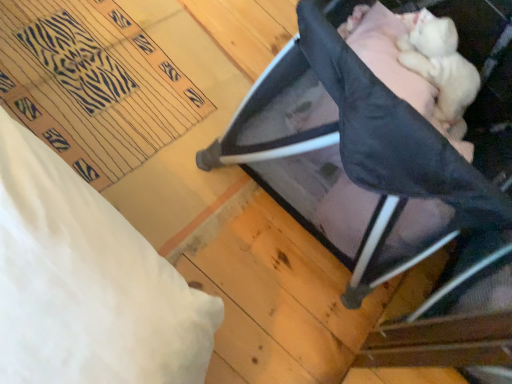
Question: Is black mesh playpen at upper right beside white fluffy newborn at upper right?

Choices:
 (A) no
 (B) yes

Answer: (A)

Question: Is black mesh playpen at upper right to the right of white fluffy newborn at upper right from the viewer's perspective?

Choices:
 (A) no
 (B) yes

Answer: (A)

Question: From the image's perspective, is black mesh playpen at upper right over white fluffy newborn at upper right?

Choices:
 (A) yes
 (B) no

Answer: (B)

Question: Could you tell me if black mesh playpen at upper right is turned towards white fluffy newborn at upper right?

Choices:
 (A) yes
 (B) no

Answer: (B)

Question: Is black mesh playpen at upper right surrounding white fluffy newborn at upper right?

Choices:
 (A) yes
 (B) no

Answer: (B)

Question: Does black mesh playpen at upper right lie behind white fluffy newborn at upper right?

Choices:
 (A) no
 (B) yes

Answer: (A)

Question: Can you confirm if white fluffy newborn at upper right is bigger than black mesh playpen at upper right?

Choices:
 (A) yes
 (B) no

Answer: (B)

Question: Can you confirm if white fluffy newborn at upper right is smaller than black mesh playpen at upper right?

Choices:
 (A) yes
 (B) no

Answer: (A)

Question: Considering the relative positions of white fluffy newborn at upper right and black mesh playpen at upper right in the image provided, is white fluffy newborn at upper right to the right of black mesh playpen at upper right from the viewer's perspective?

Choices:
 (A) no
 (B) yes

Answer: (B)

Question: Considering the relative positions of white fluffy newborn at upper right and black mesh playpen at upper right in the image provided, is white fluffy newborn at upper right in front of black mesh playpen at upper right?

Choices:
 (A) yes
 (B) no

Answer: (B)

Question: Considering the relative sizes of white fluffy newborn at upper right and black mesh playpen at upper right in the image provided, is white fluffy newborn at upper right thinner than black mesh playpen at upper right?

Choices:
 (A) no
 (B) yes

Answer: (B)

Question: Does white fluffy newborn at upper right have a greater width compared to black mesh playpen at upper right?

Choices:
 (A) yes
 (B) no

Answer: (B)

Question: From the image's perspective, is white fluffy newborn at upper right located above or below black mesh playpen at upper right?

Choices:
 (A) below
 (B) above

Answer: (B)